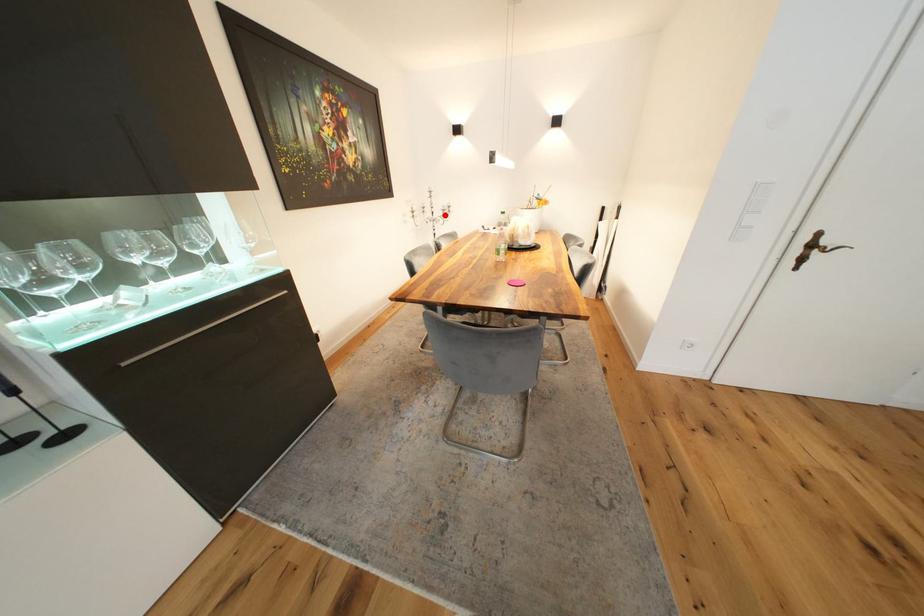
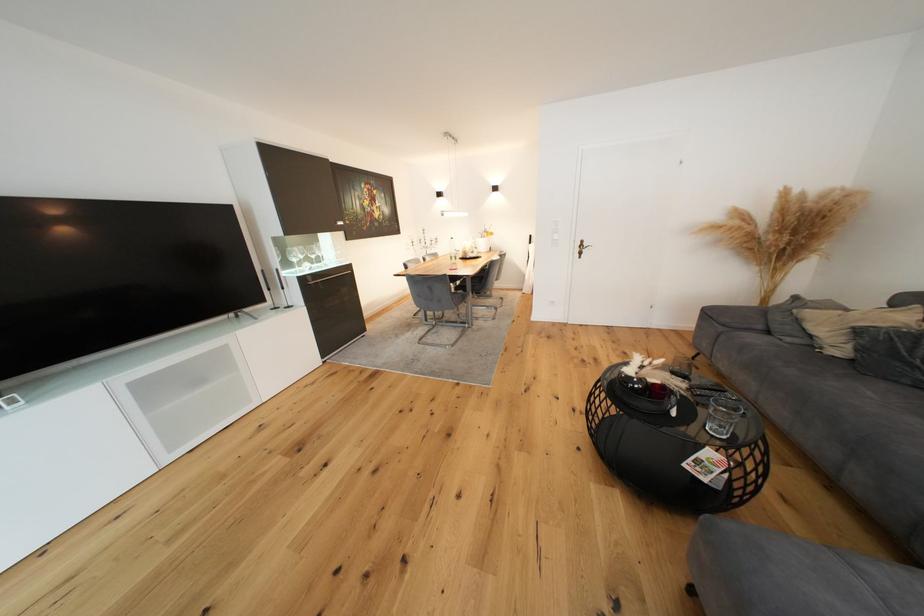
In the second image, find the point that corresponds to the highlighted location in the first image.

(435, 245)